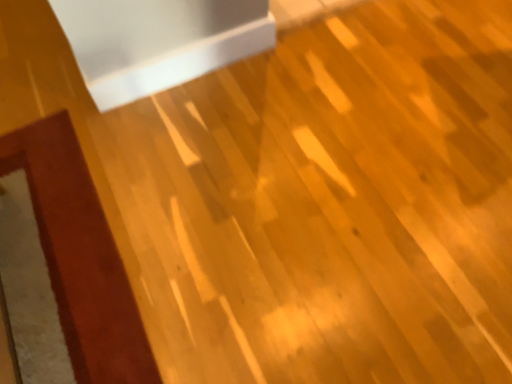
Find the location of a particular element. The height and width of the screenshot is (384, 512). brown matte mat at lower left is located at coordinates (80, 256).

Image resolution: width=512 pixels, height=384 pixels. Describe the element at coordinates (80, 256) in the screenshot. I see `brown matte mat at lower left` at that location.

Locate an element on the screen. brown matte mat at lower left is located at coordinates (80, 256).